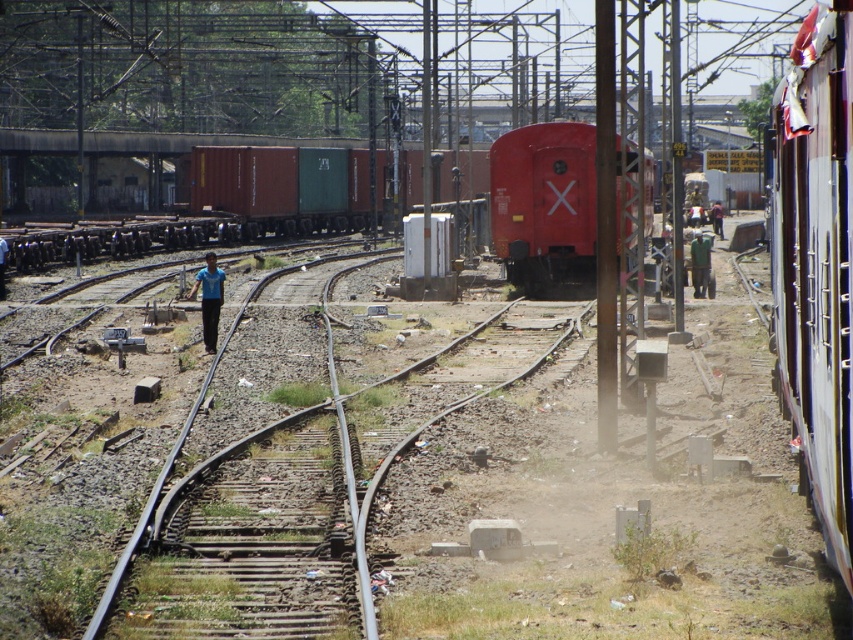
The image size is (853, 640). Describe the element at coordinates (816, 264) in the screenshot. I see `metallic silver train at right` at that location.

Is metallic silver train at right taller than blue shirt at center?

Yes, metallic silver train at right is taller than blue shirt at center.

Identify the location of metallic silver train at right. The height and width of the screenshot is (640, 853). (816, 264).

Is point (207, 346) closer to viewer compared to point (697, 259)?

That is True.

Is point (219, 280) behind point (695, 289)?

No, (219, 280) is in front of (695, 289).

Where is `blue fabric shirt at center`? The image size is (853, 640). blue fabric shirt at center is located at coordinates (209, 300).

Measure the distance between smooth red train at center and metal at left.

They are 5.67 meters apart.

Is smooth red train at center shorter than metal at left?

In fact, smooth red train at center may be taller than metal at left.

At what (x,y) coordinates should I click in order to perform the action: click on smooth red train at center. Please return your answer as a coordinate pair (x, y). The width and height of the screenshot is (853, 640). Looking at the image, I should click on (544, 204).